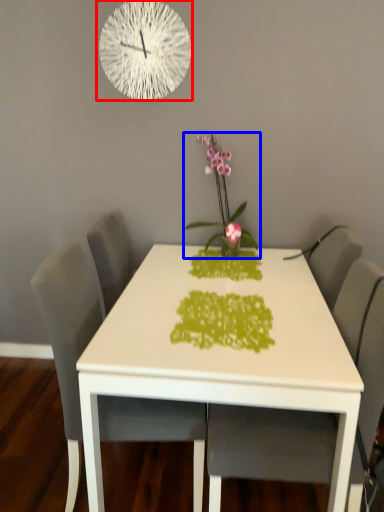
Question: Which of the following is the farthest to the observer, wall clock (highlighted by a red box) or houseplant (highlighted by a blue box)?

Choices:
 (A) wall clock
 (B) houseplant

Answer: (A)